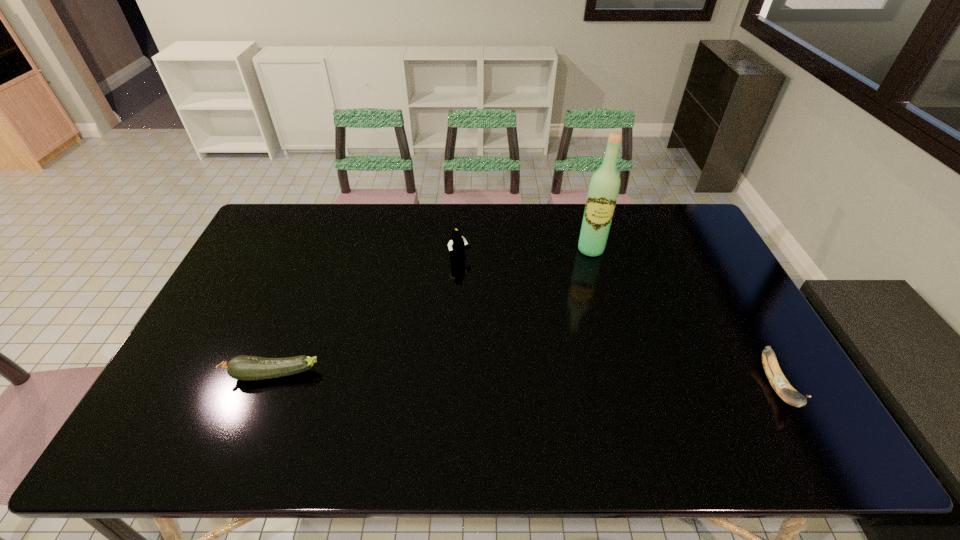
The height and width of the screenshot is (540, 960). I want to click on vacant position located 0.140m on the front-facing side of the Lego, so click(x=489, y=292).

Identify the location of vacant position located 0.100m on the front-facing side of the Lego. (482, 284).

Find the location of a particular element. The width and height of the screenshot is (960, 540). free location located 0.250m on the front-facing side of the Lego is located at coordinates (509, 315).

Find the location of a particular element. The image size is (960, 540). vacant space positioned 0.390m on the front-facing side of the wine bottle is located at coordinates (588, 351).

The width and height of the screenshot is (960, 540). Identify the location of blank space located 0.130m on the front-facing side of the wine bottle. (589, 285).

Locate an element on the screen. free space located 0.240m on the front-facing side of the wine bottle is located at coordinates (589, 310).

Locate an element on the screen. This screenshot has height=540, width=960. object that is at the far edge is located at coordinates (604, 186).

The height and width of the screenshot is (540, 960). Find the location of `zucchini that is at the near edge`. zucchini that is at the near edge is located at coordinates (247, 368).

In order to click on banana present at the near edge in this screenshot , I will do `click(778, 381)`.

Where is `object present at the left edge`? Image resolution: width=960 pixels, height=540 pixels. object present at the left edge is located at coordinates (247, 368).